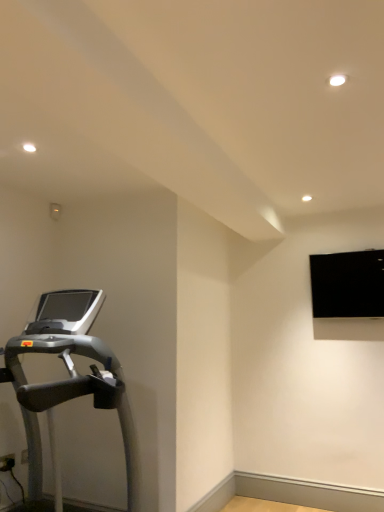
Image resolution: width=384 pixels, height=512 pixels. What do you see at coordinates (348, 284) in the screenshot?
I see `black matte projection screen at upper right` at bounding box center [348, 284].

The height and width of the screenshot is (512, 384). What are the coordinates of `black matte projection screen at upper right` in the screenshot? It's located at (348, 284).

Describe the element at coordinates (68, 380) in the screenshot. I see `silver metallic treadmill at left` at that location.

Where is `silver metallic treadmill at left`? Image resolution: width=384 pixels, height=512 pixels. silver metallic treadmill at left is located at coordinates (68, 380).

Locate an element on the screen. black matte projection screen at upper right is located at coordinates (348, 284).

Consider the image. Which object is positioned more to the right, black matte projection screen at upper right or silver metallic treadmill at left?

black matte projection screen at upper right.

Does black matte projection screen at upper right come in front of silver metallic treadmill at left?

No, the depth of black matte projection screen at upper right is greater than that of silver metallic treadmill at left.

Which point is more distant from viewer, (321, 306) or (73, 371)?

The point (321, 306) is farther from the camera.

From the image's perspective, which object appears higher, black matte projection screen at upper right or silver metallic treadmill at left?

black matte projection screen at upper right.

From a real-world perspective, is black matte projection screen at upper right below silver metallic treadmill at left?

No, from a real-world perspective, black matte projection screen at upper right is not beneath silver metallic treadmill at left.

Is black matte projection screen at upper right wider or thinner than silver metallic treadmill at left?

Clearly, black matte projection screen at upper right has less width compared to silver metallic treadmill at left.

In terms of height, does black matte projection screen at upper right look taller or shorter compared to silver metallic treadmill at left?

Considering their sizes, black matte projection screen at upper right has less height than silver metallic treadmill at left.

Considering the relative sizes of black matte projection screen at upper right and silver metallic treadmill at left in the image provided, is black matte projection screen at upper right bigger than silver metallic treadmill at left?

No, black matte projection screen at upper right is not bigger than silver metallic treadmill at left.

Is black matte projection screen at upper right surrounding silver metallic treadmill at left?

No, black matte projection screen at upper right does not contain silver metallic treadmill at left.

Consider the image. Is black matte projection screen at upper right positioned far away from silver metallic treadmill at left?

Yes, black matte projection screen at upper right and silver metallic treadmill at left are located far from each other.

Consider the image. Could you tell me if black matte projection screen at upper right is turned towards silver metallic treadmill at left?

No, black matte projection screen at upper right is not aimed at silver metallic treadmill at left.

How different are the orientations of black matte projection screen at upper right and silver metallic treadmill at left in degrees?

The angle between the facing direction of black matte projection screen at upper right and the facing direction of silver metallic treadmill at left is 90.9 degrees.

Where is `projection screen above the silver metallic treadmill at left (from a real-world perspective)`? projection screen above the silver metallic treadmill at left (from a real-world perspective) is located at coordinates (348, 284).

Between silver metallic treadmill at left and black matte projection screen at upper right, which one appears on the left side from the viewer's perspective?

silver metallic treadmill at left is more to the left.

Is the position of silver metallic treadmill at left less distant than that of black matte projection screen at upper right?

Yes, it is in front of black matte projection screen at upper right.

Between point (65, 360) and point (365, 259), which one is positioned in front?

Positioned in front is point (65, 360).

Based on the photo, from the image's perspective, which one is positioned higher, silver metallic treadmill at left or black matte projection screen at upper right?

black matte projection screen at upper right is shown above in the image.

From a real-world perspective, which object rests below the other?

silver metallic treadmill at left.

Can you confirm if silver metallic treadmill at left is wider than black matte projection screen at upper right?

Yes, silver metallic treadmill at left is wider than black matte projection screen at upper right.

From the picture: Who is taller, silver metallic treadmill at left or black matte projection screen at upper right?

Standing taller between the two is silver metallic treadmill at left.

Who is bigger, silver metallic treadmill at left or black matte projection screen at upper right?

silver metallic treadmill at left is bigger.

Consider the image. Can we say silver metallic treadmill at left lies outside black matte projection screen at upper right?

silver metallic treadmill at left is positioned outside black matte projection screen at upper right.

Is there a large distance between silver metallic treadmill at left and black matte projection screen at upper right?

Yes, silver metallic treadmill at left and black matte projection screen at upper right are quite far apart.

Is silver metallic treadmill at left positioned with its back to black matte projection screen at upper right?

No.

What's the angular difference between silver metallic treadmill at left and black matte projection screen at upper right's facing directions?

90.9 degrees.

The height and width of the screenshot is (512, 384). What are the coordinates of `treadmill on the left side of black matte projection screen at upper right` in the screenshot? It's located at (68, 380).

Where is `projection screen above the silver metallic treadmill at left (from the image's perspective)`? projection screen above the silver metallic treadmill at left (from the image's perspective) is located at coordinates (348, 284).

Locate an element on the screen. treadmill in front of the black matte projection screen at upper right is located at coordinates (68, 380).